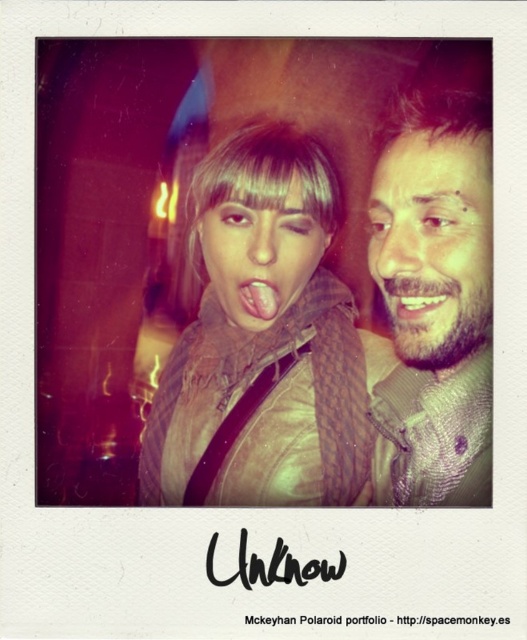
You are organizing a photo album and notice the image of two people. The matte brown scarf at center and the bearded man at upper right are important elements. Which object is located below the other in this photo?

The matte brown scarf at center is positioned under bearded man at upper right, so the scarf is below the man.

You are a photographer trying to capture a closeup shot of the two people in the image. Since the matte brown scarf at center and white glossy teeth at center are both in focus, which object appears taller in the photo?

The matte brown scarf at center appears taller than the white glossy teeth at center in the photo.

You are taking a Polaroid photo of two friends. You notice the matte brown scarf at center and the white glossy teeth at center. Which object is positioned lower in the photo?

The matte brown scarf at center is located below the white glossy teeth at center, so it is positioned lower in the photo.